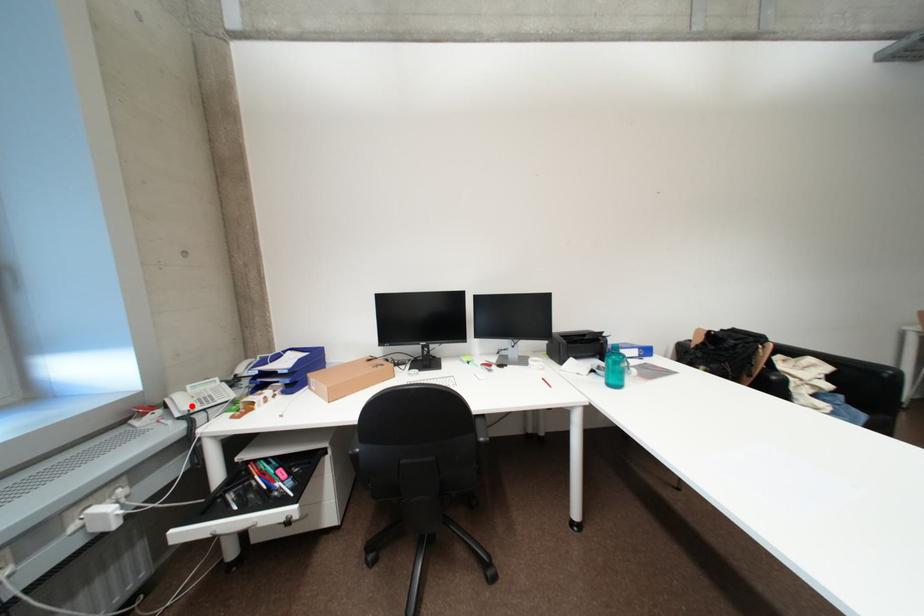
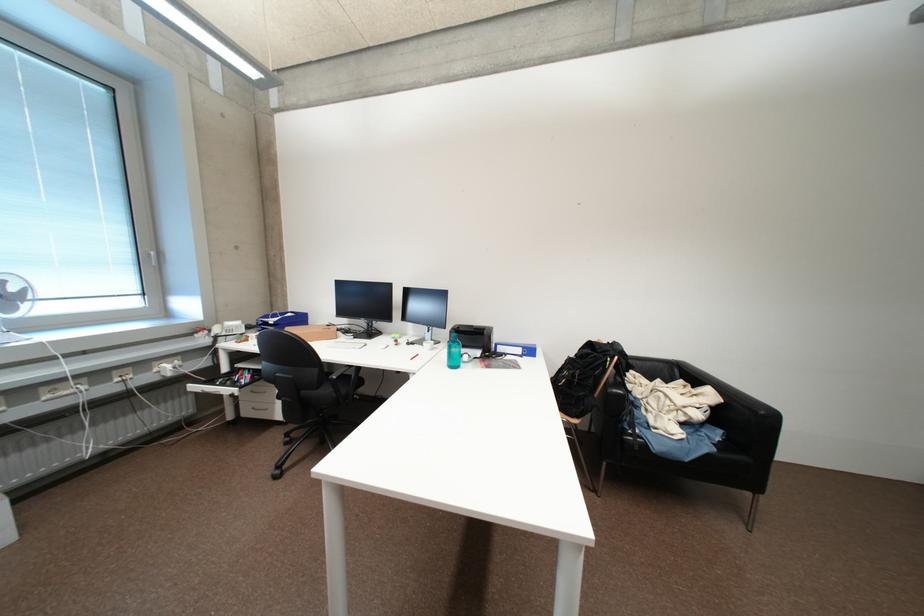
The point at the highlighted location is marked in the first image. Where is the corresponding point in the second image?

(225, 331)